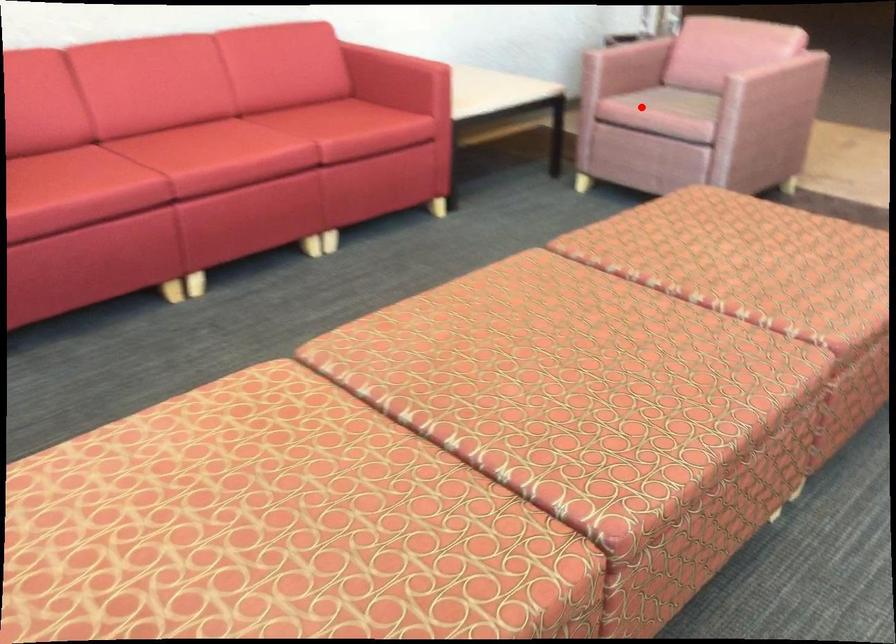
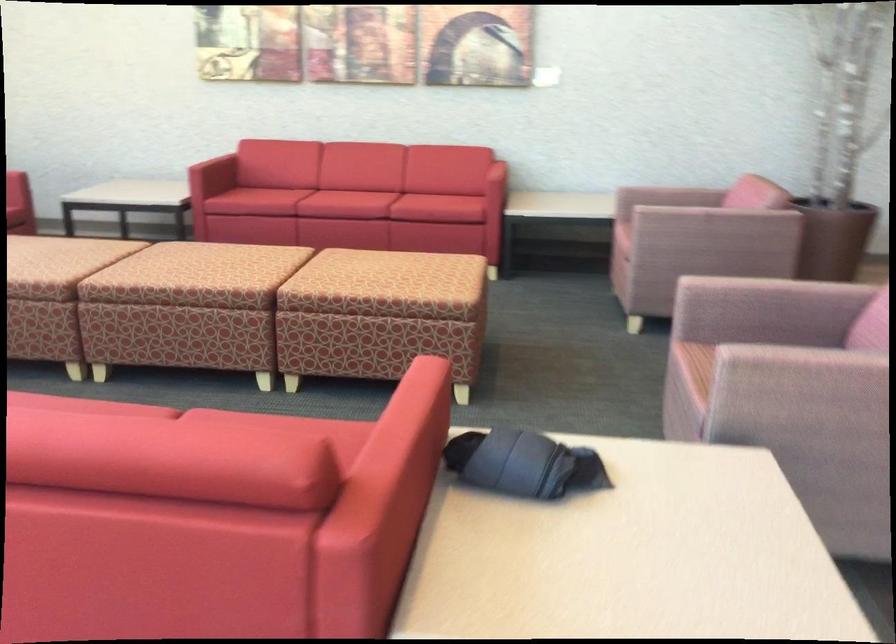
Locate, in the second image, the point that corresponds to the highlighted location in the first image.

(624, 218)